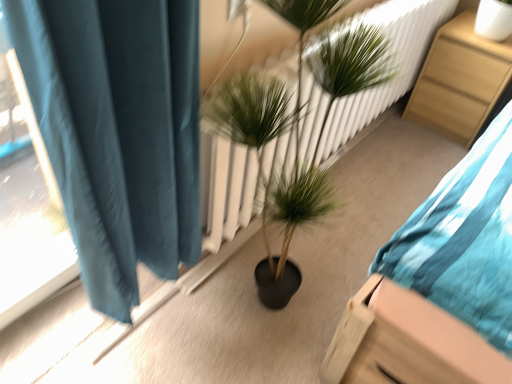
Question: Is the depth of wooden nightstand at right greater than that of green leafy plant at center?

Choices:
 (A) yes
 (B) no

Answer: (A)

Question: From a real-world perspective, is wooden nightstand at right on green leafy plant at center?

Choices:
 (A) yes
 (B) no

Answer: (B)

Question: Is wooden nightstand at right shorter than green leafy plant at center?

Choices:
 (A) yes
 (B) no

Answer: (A)

Question: Is wooden nightstand at right facing towards green leafy plant at center?

Choices:
 (A) yes
 (B) no

Answer: (A)

Question: From the image's perspective, would you say wooden nightstand at right is positioned over green leafy plant at center?

Choices:
 (A) yes
 (B) no

Answer: (A)

Question: Considering the relative sizes of wooden nightstand at right and green leafy plant at center in the image provided, is wooden nightstand at right bigger than green leafy plant at center?

Choices:
 (A) no
 (B) yes

Answer: (A)

Question: From the image's perspective, would you say green leafy plant at center is positioned over wooden nightstand at right?

Choices:
 (A) yes
 (B) no

Answer: (B)

Question: Is green leafy plant at center turned away from wooden nightstand at right?

Choices:
 (A) no
 (B) yes

Answer: (A)

Question: Is green leafy plant at center thinner than wooden nightstand at right?

Choices:
 (A) no
 (B) yes

Answer: (B)

Question: From a real-world perspective, is green leafy plant at center over wooden nightstand at right?

Choices:
 (A) no
 (B) yes

Answer: (B)

Question: Considering the relative sizes of green leafy plant at center and wooden nightstand at right in the image provided, is green leafy plant at center bigger than wooden nightstand at right?

Choices:
 (A) no
 (B) yes

Answer: (B)

Question: Is green leafy plant at center shorter than wooden nightstand at right?

Choices:
 (A) no
 (B) yes

Answer: (A)

Question: Visually, is wooden nightstand at right positioned to the left or to the right of green leafy plant at center?

Choices:
 (A) left
 (B) right

Answer: (B)